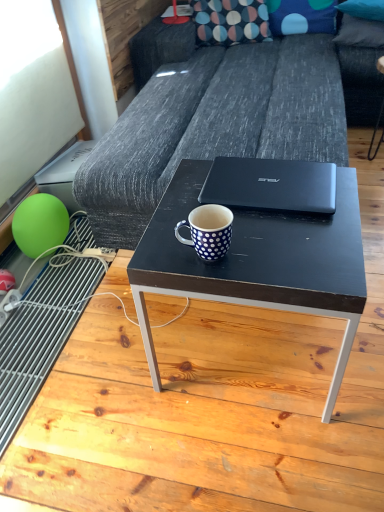
You are a GUI agent. You are given a task and a screenshot of the screen. Output one action in this format:
    pyautogui.click(x=<x>, y=<y>)
    Task: Click on the free space between blue dotted mug at center and black matte laptop at center
    
    Given the screenshot: What is the action you would take?
    pyautogui.click(x=267, y=231)